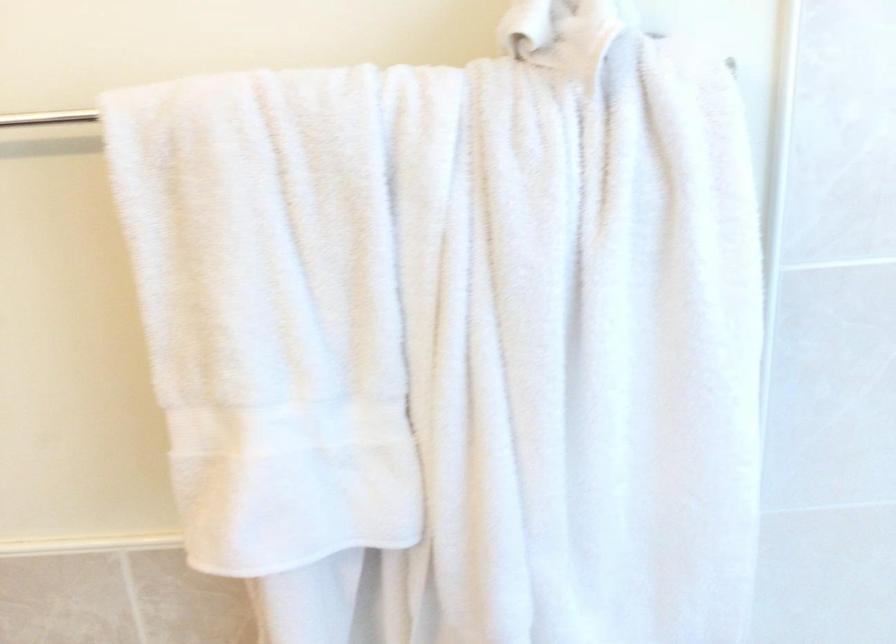
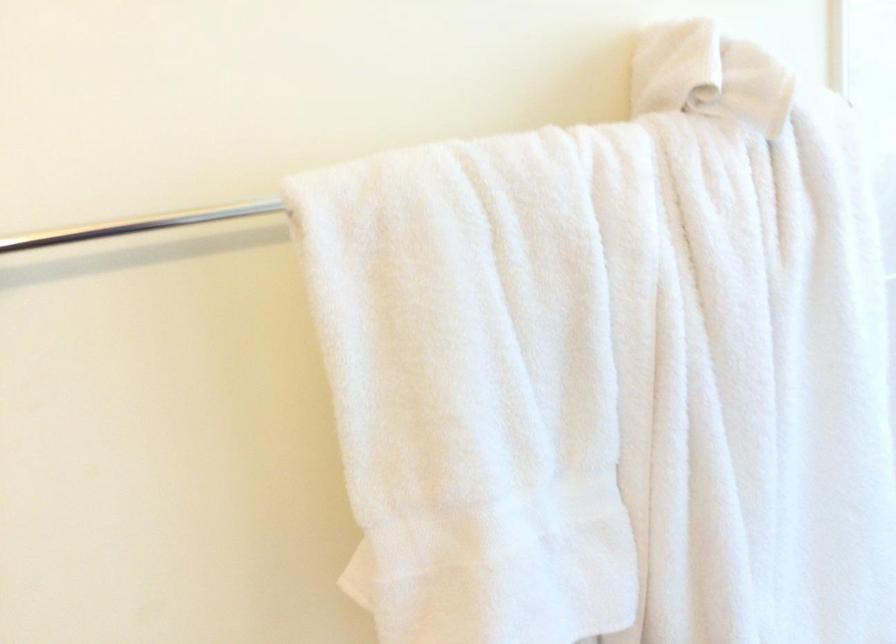
Where in the second image is the point corresponding to (367,261) from the first image?

(607, 344)